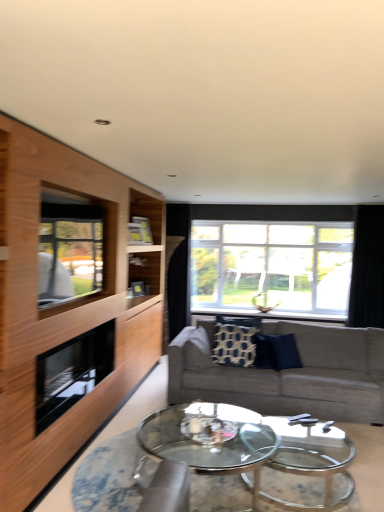
Question: Looking at their shapes, would you say textured gray couch at center is wider or thinner than wooden cabinet at left?

Choices:
 (A) thin
 (B) wide

Answer: (B)

Question: Does point (311, 355) appear closer or farther from the camera than point (11, 444)?

Choices:
 (A) farther
 (B) closer

Answer: (A)

Question: Estimate the real-world distances between objects in this image. Which object is farther from the black glass fireplace at left?

Choices:
 (A) patterned fabric pillow at center, which is the 1th pillow in left-to-right order
 (B) wooden cabinet at left
 (C) textured gray couch at center
 (D) transparent glass coffee table at center
 (E) clear glass window at center, which ranks as the second window in left-to-right order

Answer: (E)

Question: Which object is the farthest from the black glass fireplace at left?

Choices:
 (A) clear glass window at left, arranged as the first window when viewed from the front
 (B) transparent glass coffee table at center
 (C) clear glass window at center, which ranks as the first window in right-to-left order
 (D) patterned fabric pillow at center, placed as the second pillow when sorted from right to left
 (E) black velvet curtain at right

Answer: (E)